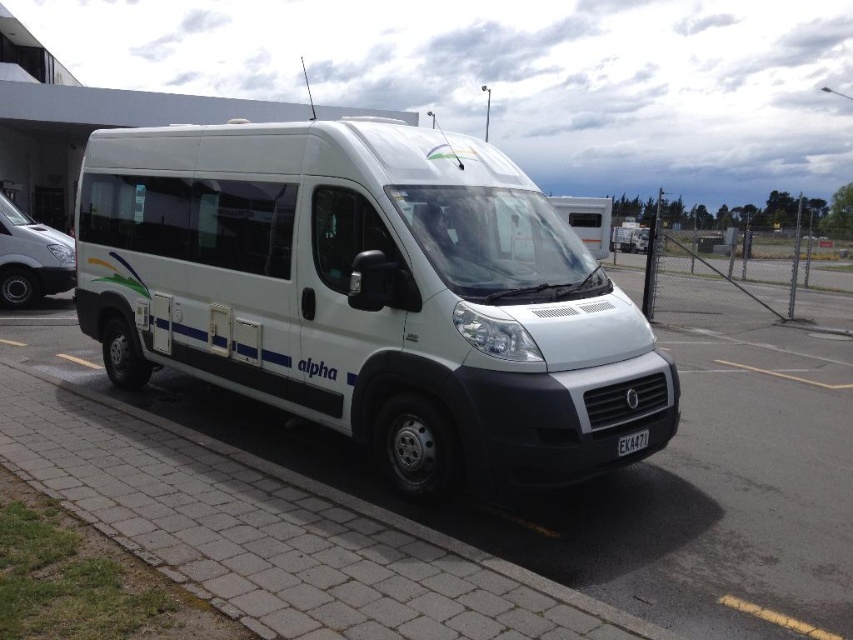
Is white matte van at center thinner than black plastic license plate at front?

Correct, white matte van at center's width is less than black plastic license plate at front's.

Who is lower down, white matte van at center or black plastic license plate at front?

Positioned lower is black plastic license plate at front.

Is point (433, 307) behind point (624, 454)?

No, (433, 307) is closer to viewer.

At what (x,y) coordinates should I click in order to perform the action: click on white matte van at center. Please return your answer as a coordinate pair (x, y). The image size is (853, 640). Looking at the image, I should click on (368, 294).

Is white brick pavement at center thinner than silver metallic van at left?

Incorrect, white brick pavement at center's width is not less than silver metallic van at left's.

Is white brick pavement at center further to the viewer compared to silver metallic van at left?

No, it is not.

This screenshot has width=853, height=640. What are the coordinates of `white brick pavement at center` in the screenshot? It's located at (619, 472).

Find the location of `white brick pavement at center`. white brick pavement at center is located at coordinates (619, 472).

Is white matte van at center to the right of white brick pavement at center from the viewer's perspective?

In fact, white matte van at center is to the left of white brick pavement at center.

Who is more distant from viewer, (x=318, y=292) or (x=851, y=468)?

Positioned behind is point (x=851, y=468).

Between point (527, 209) and point (846, 602), which one is positioned in front?

Positioned in front is point (846, 602).

At what (x,y) coordinates should I click in order to perform the action: click on white matte van at center. Please return your answer as a coordinate pair (x, y). Looking at the image, I should click on (368, 294).